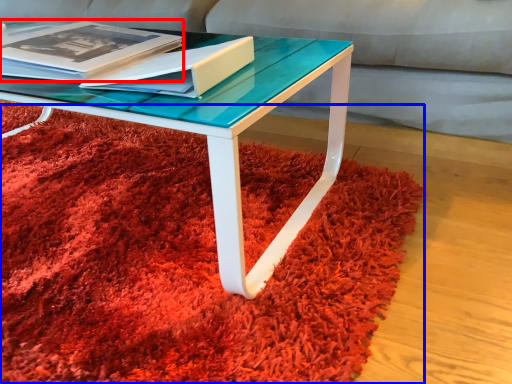
Question: Which point is closer to the camera, magazine (highlighted by a red box) or mat (highlighted by a blue box)?

Choices:
 (A) magazine
 (B) mat

Answer: (B)